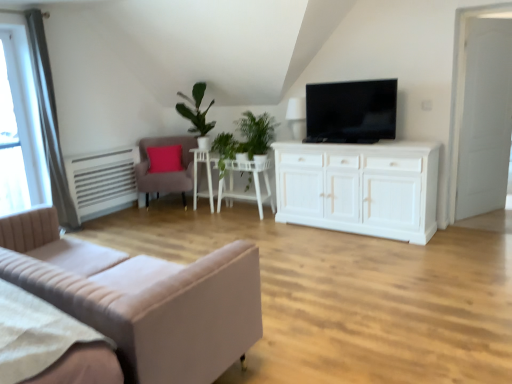
Locate an element on the screen. The height and width of the screenshot is (384, 512). free space in front of velvet pink armchair at left is located at coordinates (154, 221).